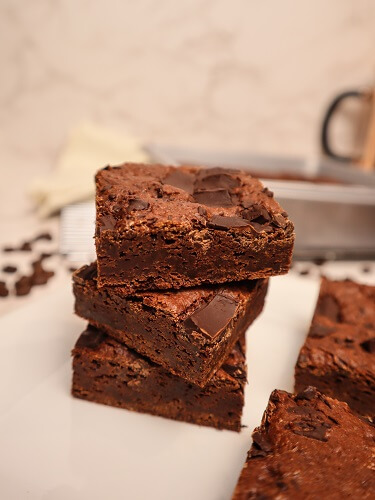
The width and height of the screenshot is (375, 500). What are the coordinates of `handle` in the screenshot? It's located at (325, 124).